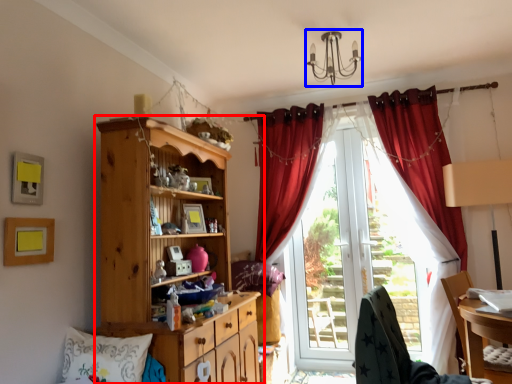
Question: Which point is further to the camera, cabinetry (highlighted by a red box) or light fixture (highlighted by a blue box)?

Choices:
 (A) cabinetry
 (B) light fixture

Answer: (B)